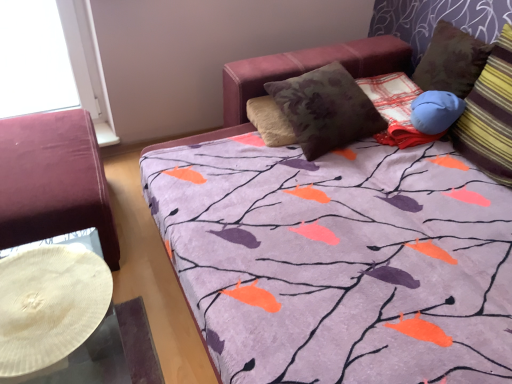
Question: From a real-world perspective, relative to velvet burgundy ottoman at left, is striped fabric pillow at right vertically above or below?

Choices:
 (A) above
 (B) below

Answer: (A)

Question: Is point (504, 157) positioned closer to the camera than point (13, 119)?

Choices:
 (A) farther
 (B) closer

Answer: (B)

Question: Is striped fabric pillow at right in front of or behind velvet burgundy ottoman at left in the image?

Choices:
 (A) front
 (B) behind

Answer: (A)

Question: From a real-world perspective, relative to striped fabric pillow at right, is velvet burgundy ottoman at left vertically above or below?

Choices:
 (A) above
 (B) below

Answer: (B)

Question: From the image's perspective, is velvet burgundy ottoman at left positioned above or below striped fabric pillow at right?

Choices:
 (A) below
 (B) above

Answer: (A)

Question: In terms of width, does velvet burgundy ottoman at left look wider or thinner when compared to striped fabric pillow at right?

Choices:
 (A) thin
 (B) wide

Answer: (B)

Question: In the image, is velvet burgundy ottoman at left on the left side or the right side of striped fabric pillow at right?

Choices:
 (A) left
 (B) right

Answer: (A)